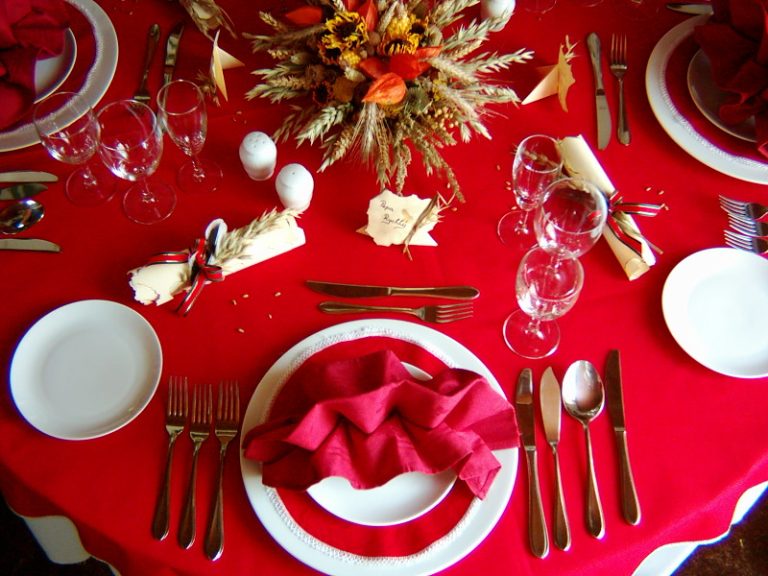
Locate an element on the screen. white plates is located at coordinates (108, 352), (270, 378), (359, 481), (697, 361), (686, 150), (712, 117), (106, 75), (57, 64).